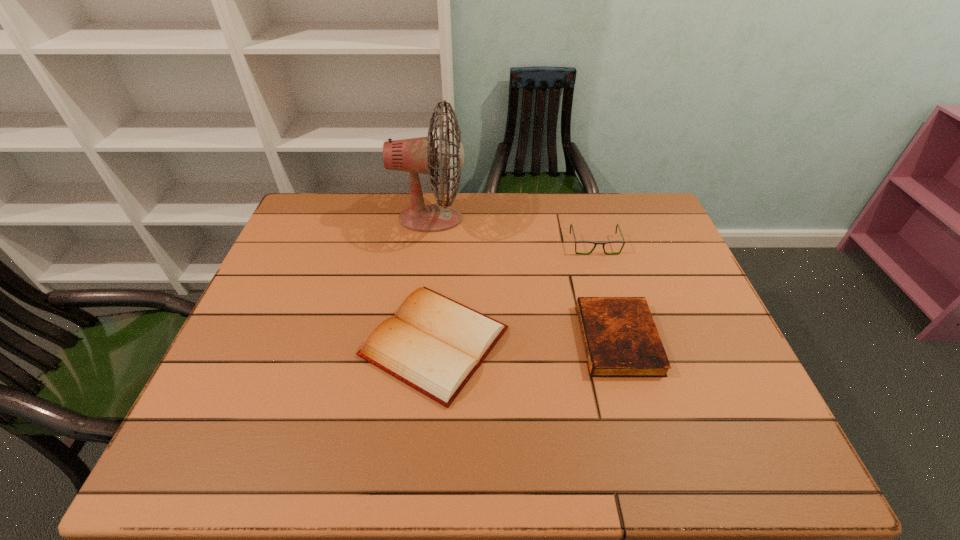
Locate an element on the screen. fan is located at coordinates (416, 155).

The width and height of the screenshot is (960, 540). Identify the location of spectacles. (582, 241).

At what (x,y) coordinates should I click in order to perform the action: click on the left Bible. Please return your answer as a coordinate pair (x, y). The width and height of the screenshot is (960, 540). Looking at the image, I should click on (434, 344).

At what (x,y) coordinates should I click in order to perform the action: click on the right Bible. Please return your answer as a coordinate pair (x, y). Looking at the image, I should click on tap(620, 337).

At what (x,y) coordinates should I click in order to perform the action: click on free space located in front of the fan to direct airflow. Please return your answer as a coordinate pair (x, y). Looking at the image, I should click on (547, 219).

Locate an element on the screen. The image size is (960, 540). vacant area situated 0.130m on the lens of the third shortest object is located at coordinates (606, 285).

The height and width of the screenshot is (540, 960). What are the coordinates of `free space located on the back of the left Bible` in the screenshot? It's located at (441, 274).

Image resolution: width=960 pixels, height=540 pixels. What are the coordinates of `vacant space situated on the spine side of the right Bible` in the screenshot? It's located at (559, 339).

Identify the location of free space located on the spine side of the right Bible. The height and width of the screenshot is (540, 960). (511, 339).

At what (x,y) coordinates should I click in order to perform the action: click on free point located 0.080m on the spine side of the right Bible. Please return your answer as a coordinate pair (x, y). Looking at the image, I should click on (550, 339).